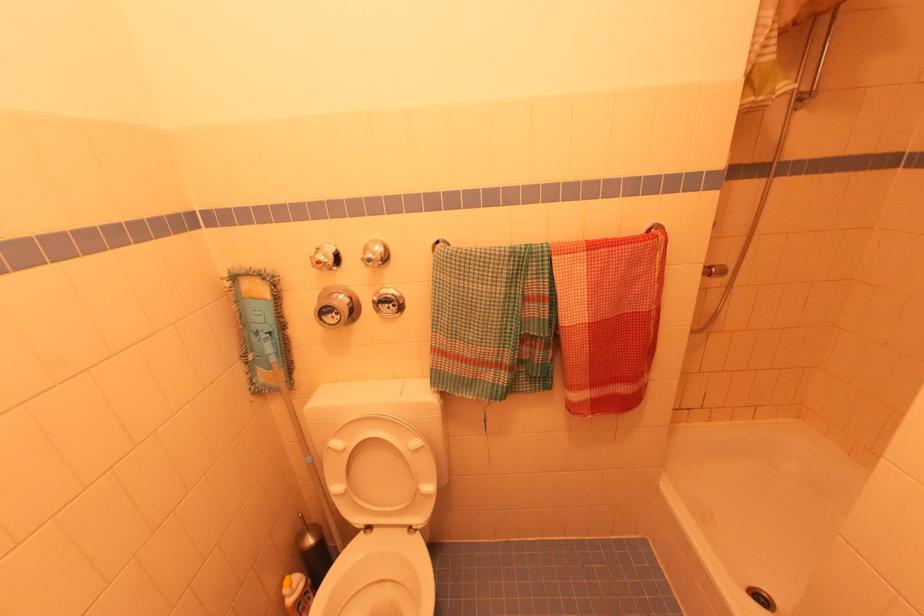
Where is `small wall dial`? This screenshot has width=924, height=616. small wall dial is located at coordinates (387, 302).